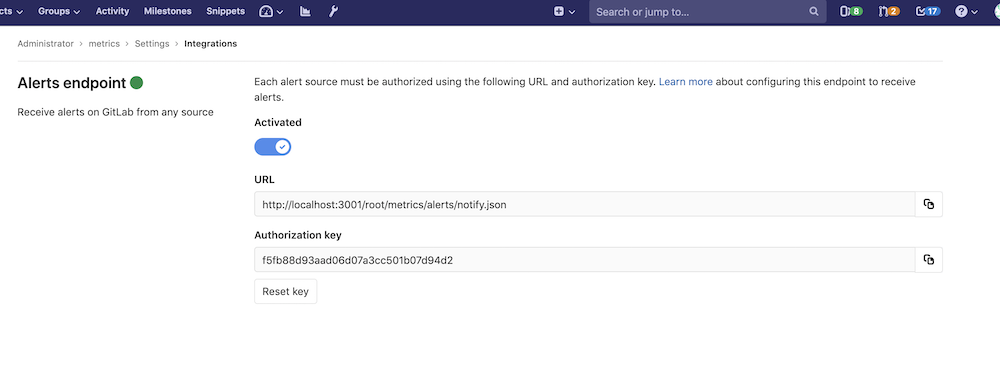
Locate an element on the screen. This screenshot has width=1000, height=387. on and off activation switch is located at coordinates (272, 144).